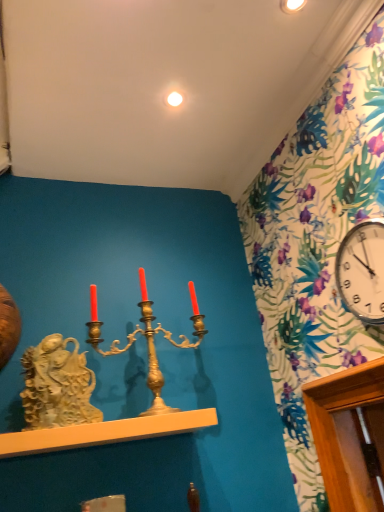
Question: In terms of height, does smooth white shelf at center look taller or shorter compared to white glossy clock at upper right?

Choices:
 (A) tall
 (B) short

Answer: (B)

Question: In terms of size, does smooth white shelf at center appear bigger or smaller than white glossy clock at upper right?

Choices:
 (A) big
 (B) small

Answer: (A)

Question: Which is farther from the white glossy light bulb at upper center?

Choices:
 (A) white stone sculpture at left
 (B) gold metallic candle holder at center
 (C) smooth white shelf at center
 (D) white glossy clock at upper right

Answer: (C)

Question: Which is nearer to the white stone sculpture at left?

Choices:
 (A) white glossy light bulb at upper center
 (B) smooth white shelf at center
 (C) white glossy clock at upper right
 (D) gold metallic candle holder at center

Answer: (B)